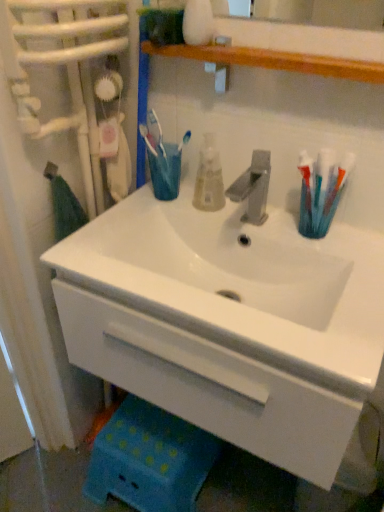
You are a GUI agent. You are given a task and a screenshot of the screen. Output one action in this format:
    pyautogui.click(x=<x>, y=<y>)
    Task: Click on the free space in front of translucent plastic toothbrushes at right
    
    Given the screenshot: What is the action you would take?
    pyautogui.click(x=353, y=273)